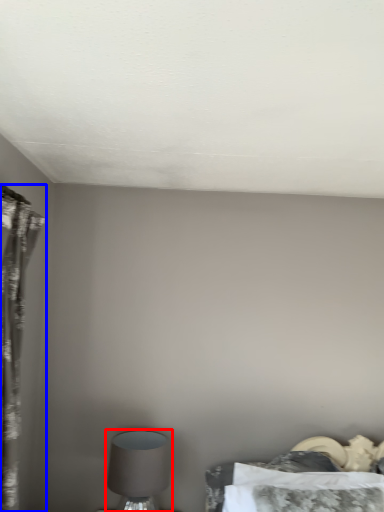
Question: Among these objects, which one is nearest to the camera, table lamp (highlighted by a red box) or curtain (highlighted by a blue box)?

Choices:
 (A) table lamp
 (B) curtain

Answer: (B)